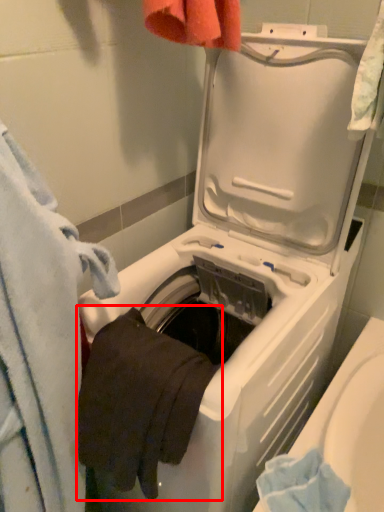
Question: From the image, what is the correct spatial relationship of bath towel (annotated by the red box) in relation to towel?

Choices:
 (A) left
 (B) right

Answer: (B)